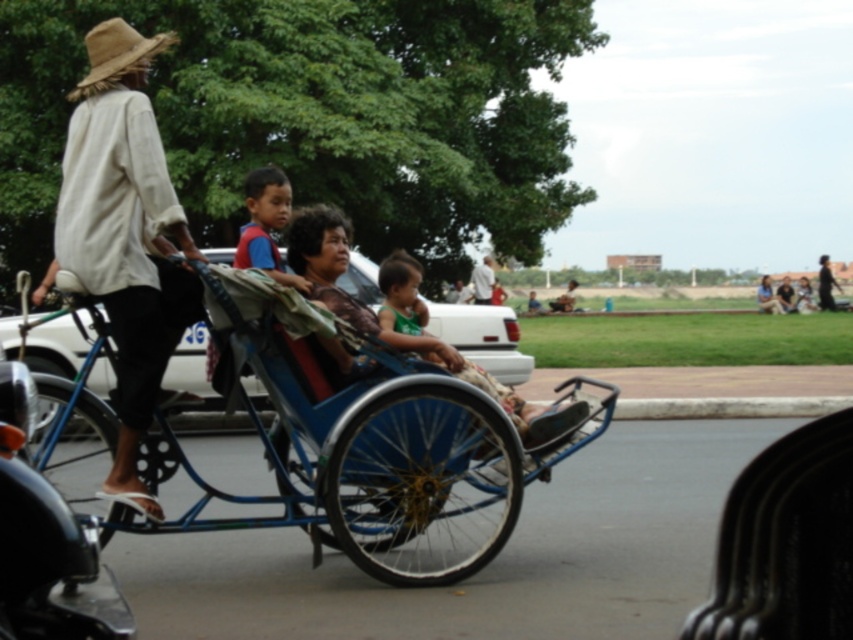
You are a photographer trying to capture a photo of the green fabric baby carriage at center without including the light beige cotton shirt at left in the frame. Based on their positions, is this possible?

The light beige cotton shirt at left is positioned on the left side of green fabric baby carriage at center, so if you move to the right side of the carriage, you can exclude the shirt from the frame.

You are a photographer trying to capture the scene with the natural straw hat at upper left and the white cotton shirt at upper center. Which object should you zoom in on to ensure both are visible without cropping? Explain your reasoning based on their sizes.

The natural straw hat at upper left is wider than the white cotton shirt at upper center. To ensure both are visible without cropping, you should zoom in on the natural straw hat at upper left since it is wider, and the white cotton shirt at upper center will naturally fit within the same frame.

You are a photographer trying to capture a photo of the white cotton shirt at upper center and the dark blue fabric jacket at center. Which one should you focus on first if you want to include both in your frame without moving your camera?

The white cotton shirt at upper center is not as tall as the dark blue fabric jacket at center, so you should focus on the dark blue fabric jacket at center first to ensure it fits within the frame.